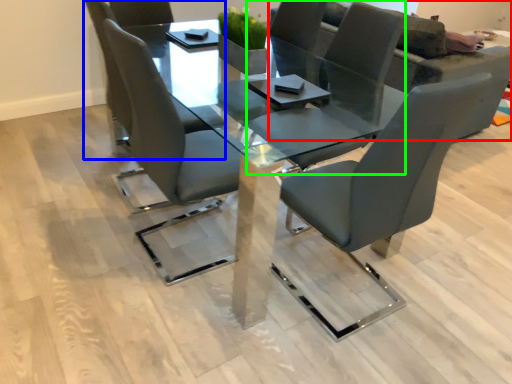
Question: Based on their relative distances, which object is nearer to couch (highlighted by a red box)? Choose from chair (highlighted by a blue box) and chair (highlighted by a green box).

Choices:
 (A) chair
 (B) chair

Answer: (B)